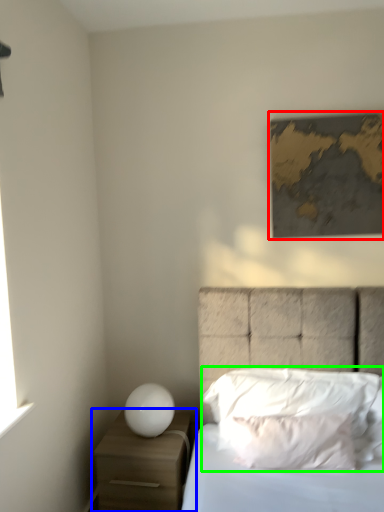
Question: Which is nearer to the picture frame (highlighted by a red box)? nightstand (highlighted by a blue box) or pillow (highlighted by a green box).

Choices:
 (A) nightstand
 (B) pillow

Answer: (B)